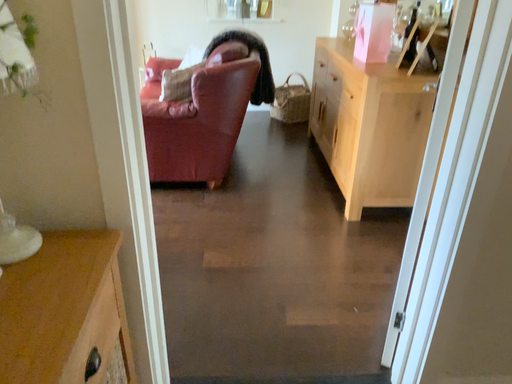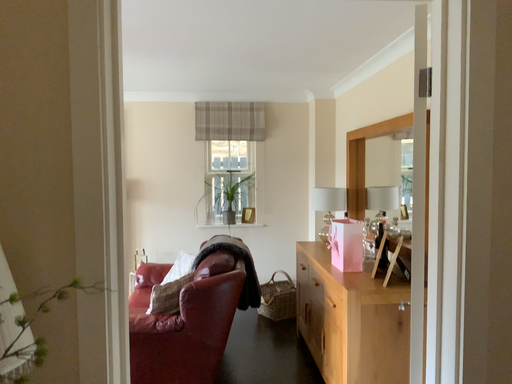
Question: How did the camera likely rotate when shooting the video?

Choices:
 (A) rotated upward
 (B) rotated downward

Answer: (A)